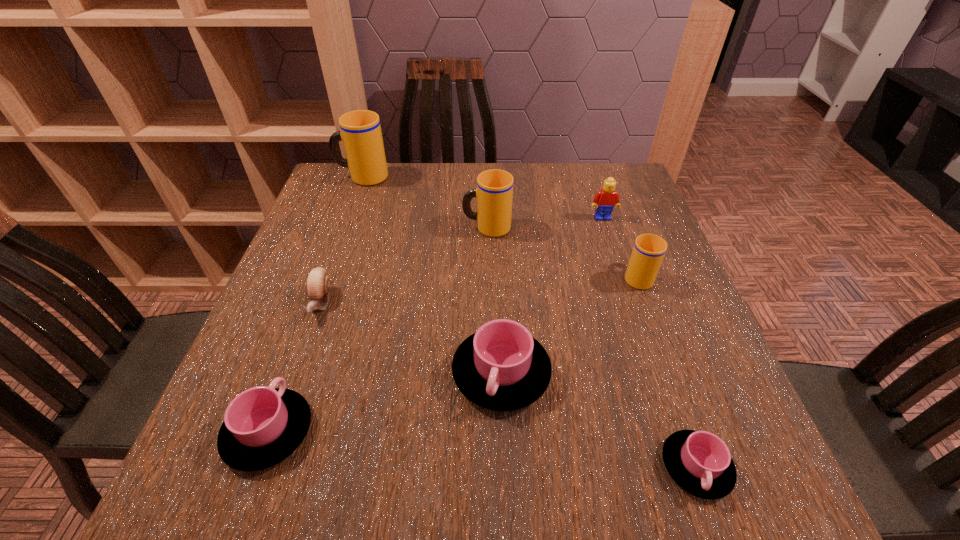
Locate an element on the screen. free space between the smallest beige cup and the leftmost pink cup is located at coordinates (453, 354).

Find the location of a particular element. The height and width of the screenshot is (540, 960). vacant point located between the shortest object and the biggest pink cup is located at coordinates (599, 420).

You are a GUI agent. You are given a task and a screenshot of the screen. Output one action in this format:
    pyautogui.click(x=<x>, y=<y>)
    Task: Click on the vacant area that lies between the smallest pink cup and the farthest object
    Image resolution: width=960 pixels, height=540 pixels.
    Given the screenshot: What is the action you would take?
    pyautogui.click(x=529, y=322)

At what (x,y) coordinates should I click in order to perform the action: click on the second closest object relative to the biggest pink cup. Please return your answer as a coordinate pair (x, y). Image resolution: width=960 pixels, height=540 pixels. Looking at the image, I should click on (263, 425).

Identify which object is the third nearest to the shortest object. Please provide its 2D coordinates. Your answer should be formatted as a tuple, i.e. [(x, y)], where the tuple contains the x and y coordinates of a point satisfying the conditions above.

[(494, 192)]

Find the location of `the third closest cup to the nearest beige cup`. the third closest cup to the nearest beige cup is located at coordinates (699, 462).

Point out which cup is positioned as the second nearest to the tallest cup. Please provide its 2D coordinates. Your answer should be formatted as a tuple, i.e. [(x, y)], where the tuple contains the x and y coordinates of a point satisfying the conditions above.

[(501, 367)]

Point out which beige cup is positioned as the nearest to the biggest pink cup. Please provide its 2D coordinates. Your answer should be formatted as a tuple, i.e. [(x, y)], where the tuple contains the x and y coordinates of a point satisfying the conditions above.

[(648, 252)]

Identify which beige cup is located as the second nearest to the escargot. Please provide its 2D coordinates. Your answer should be formatted as a tuple, i.e. [(x, y)], where the tuple contains the x and y coordinates of a point satisfying the conditions above.

[(361, 134)]

Select which pink cup appears as the closest to the nearest beige cup. Please provide its 2D coordinates. Your answer should be formatted as a tuple, i.e. [(x, y)], where the tuple contains the x and y coordinates of a point satisfying the conditions above.

[(501, 367)]